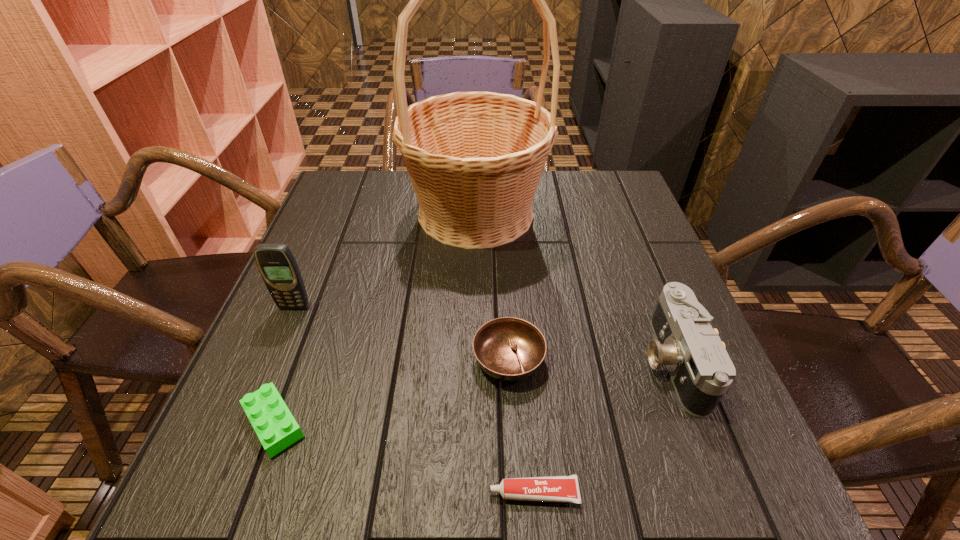
This screenshot has height=540, width=960. What are the coordinates of `object at the far edge` in the screenshot? It's located at (475, 159).

Identify the location of Lego that is at the near edge. (275, 426).

At what (x,y) coordinates should I click in order to perform the action: click on toothpaste situated at the near edge. Please return your answer as a coordinate pair (x, y). Looking at the image, I should click on (553, 488).

What are the coordinates of `cellular telephone present at the left edge` in the screenshot? It's located at (277, 265).

Where is `Lego that is at the left edge`? The width and height of the screenshot is (960, 540). Lego that is at the left edge is located at coordinates (275, 426).

Identify the location of object located in the right edge section of the desktop. (701, 371).

At what (x,y) coordinates should I click in order to perform the action: click on object at the near left corner. Please return your answer as a coordinate pair (x, y). This screenshot has height=540, width=960. Looking at the image, I should click on (275, 426).

Identify the location of free space at the near edge of the desktop. (630, 496).

The image size is (960, 540). In the image, there is a desktop. In order to click on vacant space at the left edge in this screenshot , I will do `click(327, 272)`.

In the image, there is a desktop. At what (x,y) coordinates should I click in order to perform the action: click on vacant space at the right edge. Please return your answer as a coordinate pair (x, y). The image size is (960, 540). Looking at the image, I should click on (652, 237).